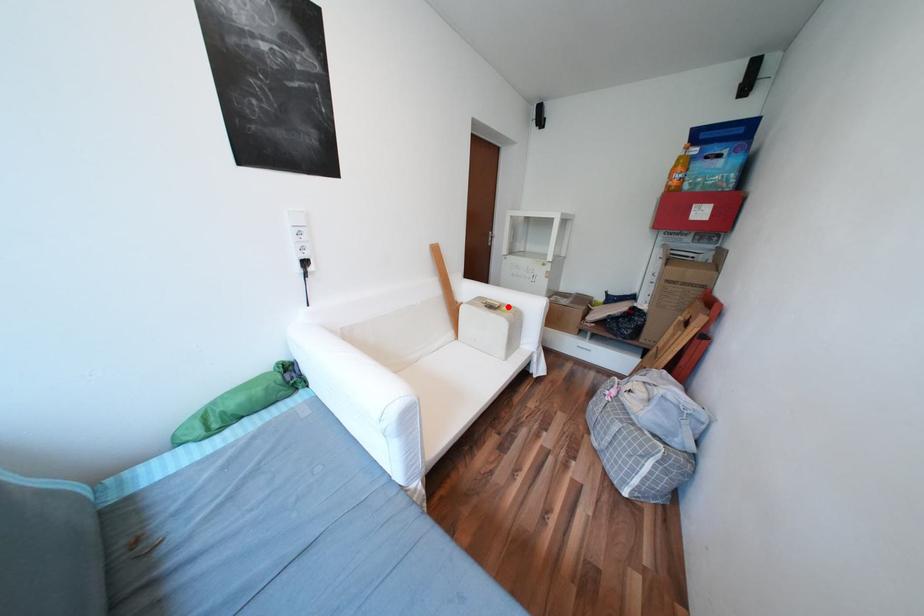
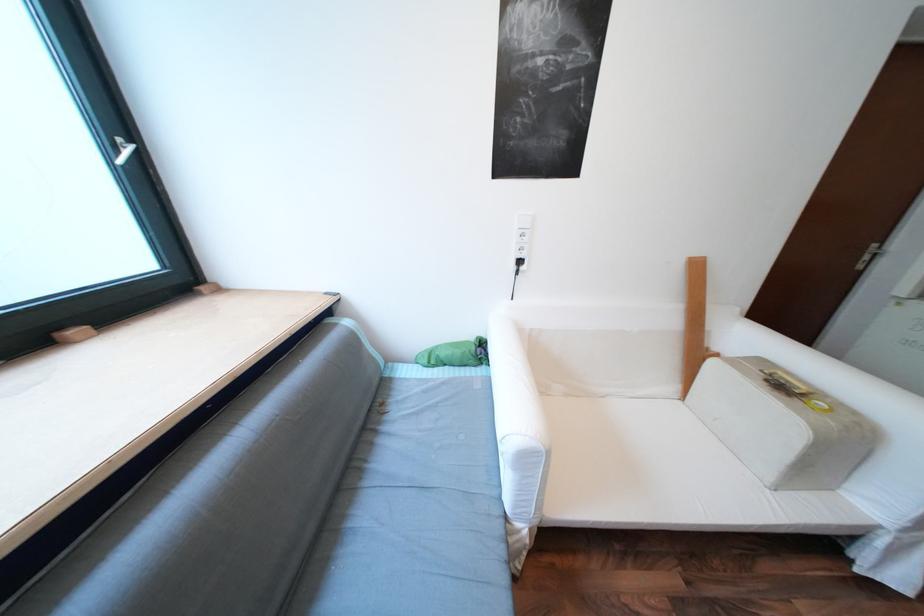
The point at the highlighted location is marked in the first image. Where is the corresponding point in the second image?

(811, 394)